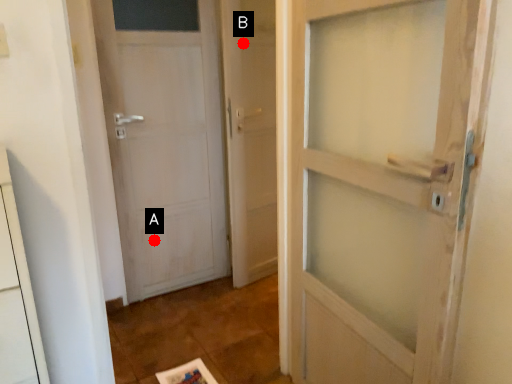
Question: Two points are circled on the image, labeled by A and B beside each circle. Which point is farther to the camera?

Choices:
 (A) A is further
 (B) B is further

Answer: (A)